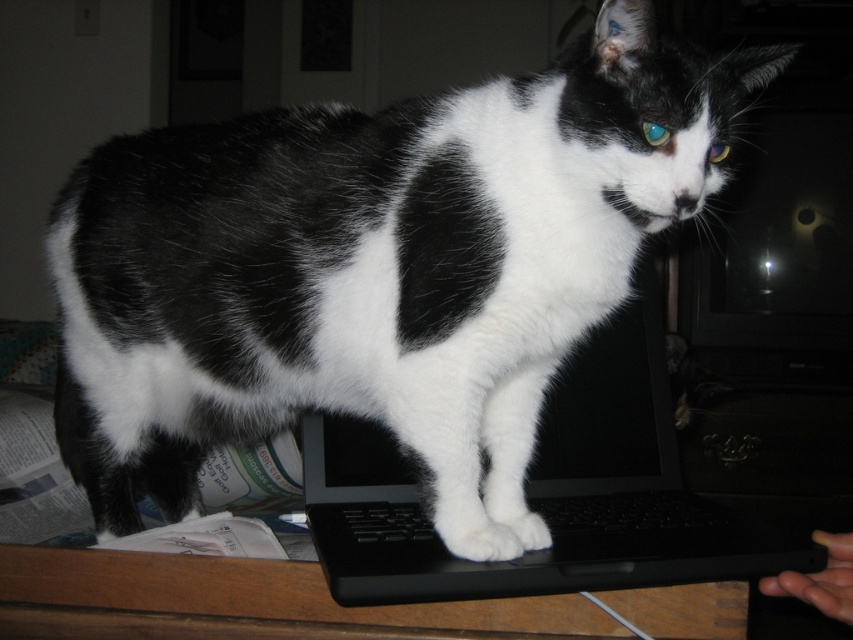
Which is more to the left, black plastic laptop at center or black matte keyboard at center?

Positioned to the left is black plastic laptop at center.

Who is positioned more to the right, black plastic laptop at center or black matte keyboard at center?

From the viewer's perspective, black matte keyboard at center appears more on the right side.

You are a GUI agent. You are given a task and a screenshot of the screen. Output one action in this format:
    pyautogui.click(x=<x>, y=<y>)
    Task: Click on the black plastic laptop at center
    This screenshot has height=640, width=853.
    Given the screenshot: What is the action you would take?
    pyautogui.click(x=546, y=492)

Locate an element on the screen. The image size is (853, 640). black plastic laptop at center is located at coordinates (546, 492).